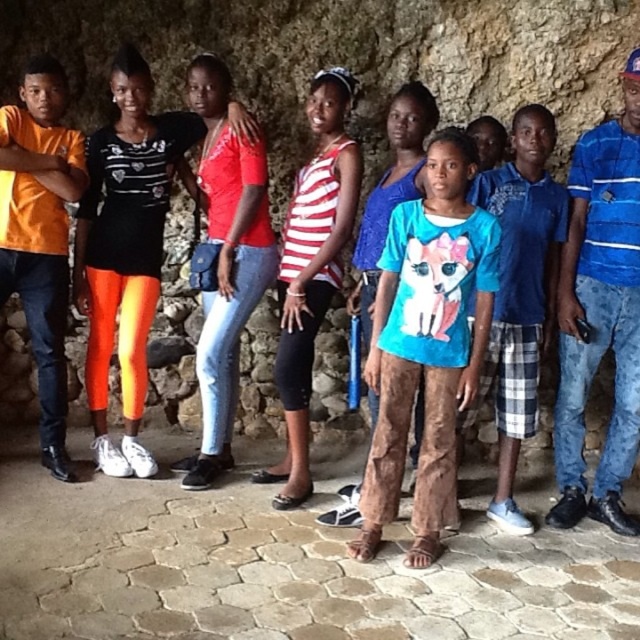
Question: Can you confirm if neon orange leggings at center is wider than striped fabric tank top at center?

Choices:
 (A) yes
 (B) no

Answer: (A)

Question: Which object is farther from the camera taking this photo?

Choices:
 (A) blue cotton shirt at center
 (B) brown textured pants at center

Answer: (B)

Question: Which point is closer to the camera?

Choices:
 (A) [x=488, y=508]
 (B) [x=131, y=346]
 (C) [x=285, y=390]
 (D) [x=394, y=156]

Answer: (C)

Question: Among these points, which one is nearest to the camera?

Choices:
 (A) (566, 198)
 (B) (353, 93)
 (C) (465, 220)
 (D) (109, 296)

Answer: (C)

Question: Can you confirm if neon orange leggings at center is positioned above blue plaid shorts at center?

Choices:
 (A) no
 (B) yes

Answer: (B)

Question: Is neon orange leggings at center above blue plaid shorts at center?

Choices:
 (A) yes
 (B) no

Answer: (A)